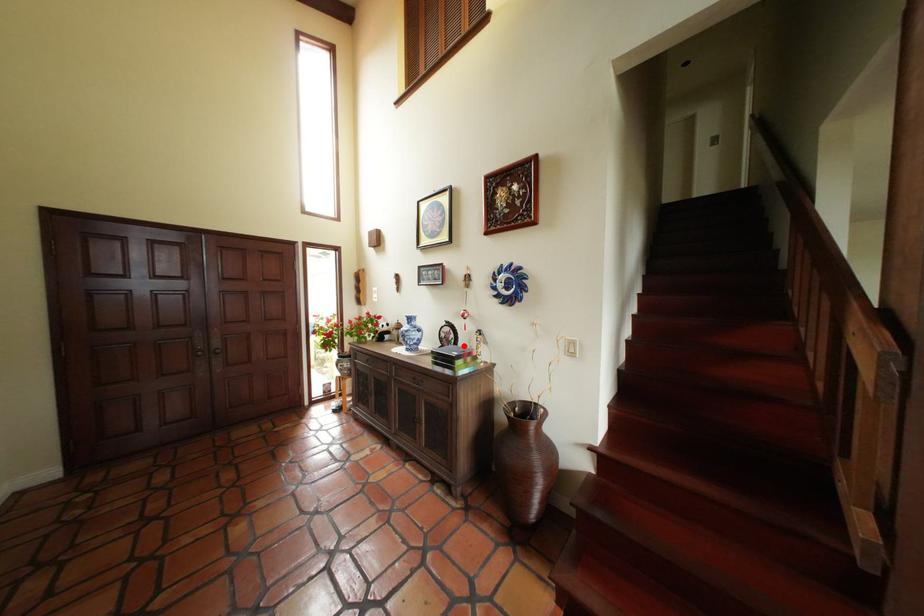
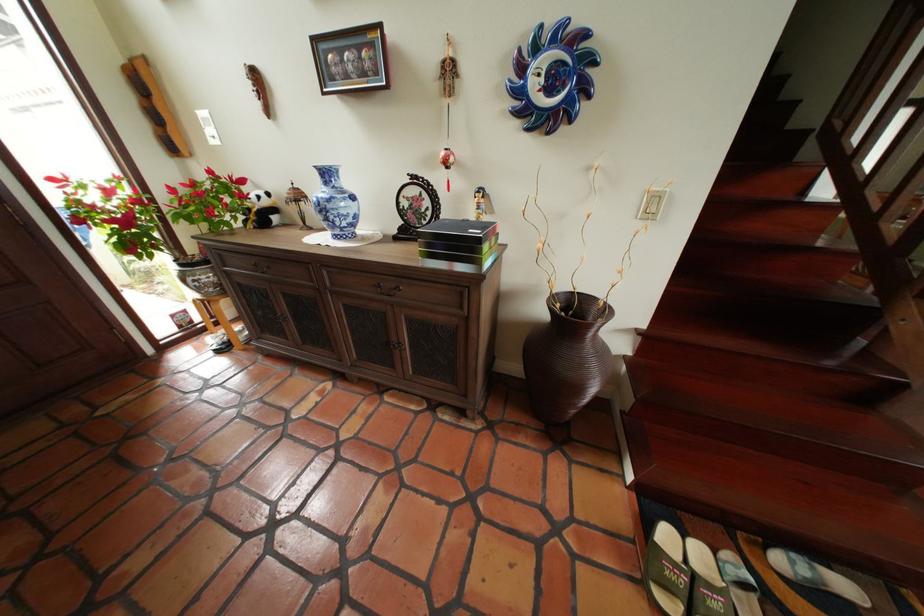
Where in the second image is the point corresponding to the highlighted location from the first image?

(438, 221)